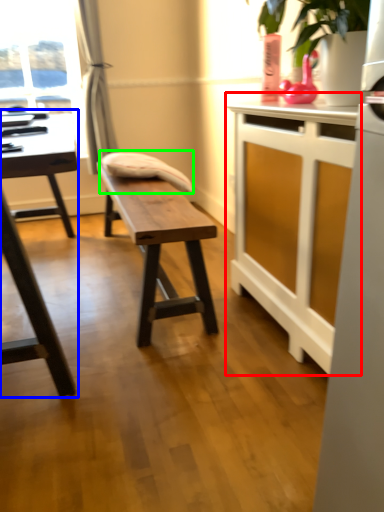
Question: Which object is positioned farthest from table (highlighted by a red box)? Select from table (highlighted by a blue box) and swivel chair (highlighted by a green box).

Choices:
 (A) table
 (B) swivel chair

Answer: (A)